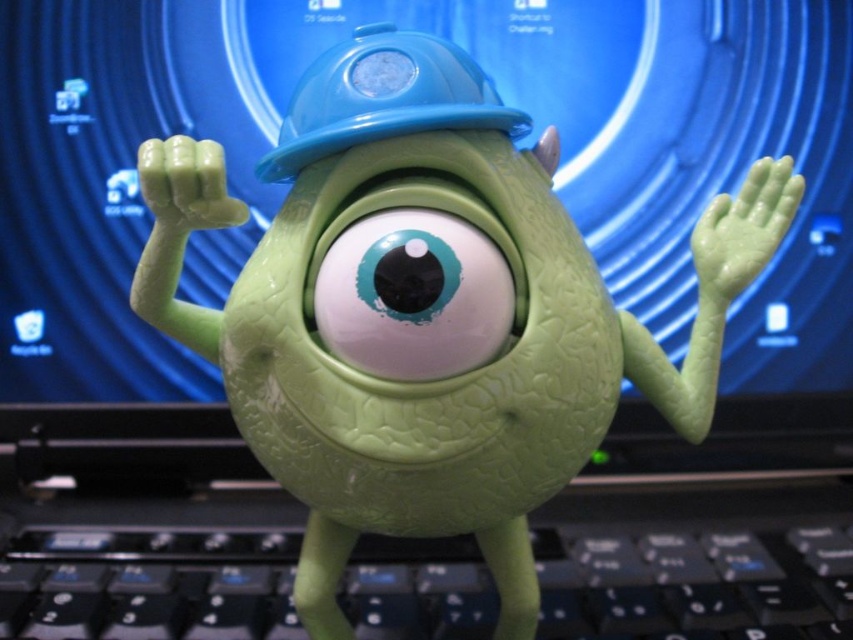
Question: Does matte green eye at center have a lesser width compared to blue hard hat at center?

Choices:
 (A) yes
 (B) no

Answer: (A)

Question: Can you confirm if matte green eye at center is smaller than blue hard hat at center?

Choices:
 (A) yes
 (B) no

Answer: (A)

Question: Which of these objects is positioned farthest from the blue hard hat at center?

Choices:
 (A) black plastic keyboard at center
 (B) matte green eye at center

Answer: (A)

Question: Does black plastic keyboard at center lie in front of matte green eye at center?

Choices:
 (A) yes
 (B) no

Answer: (B)

Question: Which object is closer to the camera taking this photo?

Choices:
 (A) black plastic keyboard at center
 (B) blue hard hat at center
 (C) matte green eye at center

Answer: (C)

Question: Which point is closer to the camera taking this photo?

Choices:
 (A) (366, 273)
 (B) (366, 83)
 (C) (142, 612)

Answer: (A)